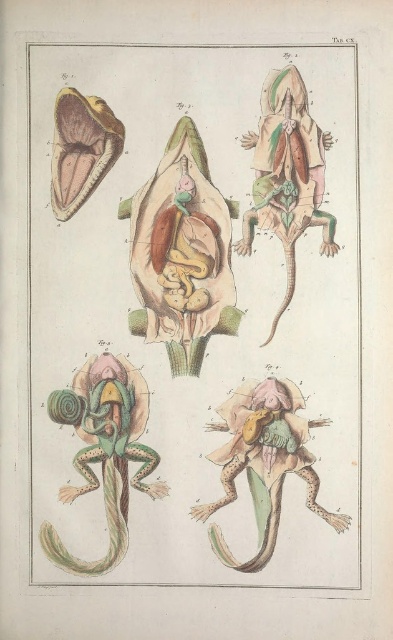
Describe the element at coordinates (104, 451) in the screenshot. I see `green textured frog at lower left` at that location.

Who is more forward, [110,474] or [71,186]?

Point [71,186]

Describe the element at coordinates (104, 451) in the screenshot. Image resolution: width=393 pixels, height=640 pixels. I see `green textured frog at lower left` at that location.

Identify the location of green textured frog at lower left. The height and width of the screenshot is (640, 393). coord(104,451).

Between green textured lizard at center and green textured frog at lower left, which one has less height?

green textured frog at lower left

How much distance is there between green textured lizard at center and green textured frog at lower left?

The distance of green textured lizard at center from green textured frog at lower left is 4.93 inches.

Find the location of a particular element. green textured lizard at center is located at coordinates (183, 321).

The image size is (393, 640). Describe the element at coordinates (183, 321) in the screenshot. I see `green textured lizard at center` at that location.

Does green textured lizard at center have a lesser height compared to matte green lizard at bottom right?

No.

Who is more forward, (255, 563) or (310, 424)?

Point (255, 563) is in front.

The width and height of the screenshot is (393, 640). Find the location of `green textured lizard at center`. green textured lizard at center is located at coordinates (183, 321).